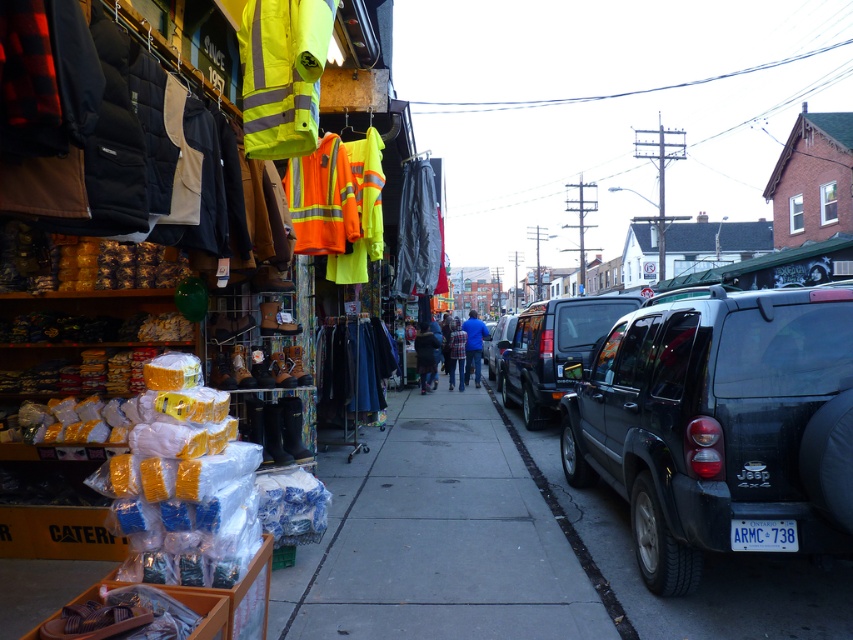
Which is below, yellow reflective safety vest at upper center or dark blue jeans at center?

dark blue jeans at center

Is yellow reflective safety vest at upper center further to the viewer compared to dark blue jeans at center?

That is False.

Is point (271, 1) behind point (424, 362)?

That is False.

The image size is (853, 640). I want to click on yellow reflective safety vest at upper center, so click(x=282, y=74).

Can you confirm if yellow reflective safety vest at upper center is positioned to the right of matte black suv at center-right?

In fact, yellow reflective safety vest at upper center is to the left of matte black suv at center-right.

Is the position of yellow reflective safety vest at upper center less distant than that of matte black suv at center-right?

Yes, it is.

Where is `yellow reflective safety vest at upper center`? The height and width of the screenshot is (640, 853). yellow reflective safety vest at upper center is located at coordinates (282, 74).

Can you confirm if smooth concrete sidewalk at center is smaller than matte black suv at center-right?

No, smooth concrete sidewalk at center is not smaller than matte black suv at center-right.

Is smooth concrete sidewalk at center wider than matte black suv at center-right?

Correct, the width of smooth concrete sidewalk at center exceeds that of matte black suv at center-right.

Measure the distance between point [323,582] and camera.

Point [323,582] and camera are 5.20 meters apart.

Identify the location of smooth concrete sidewalk at center. (442, 538).